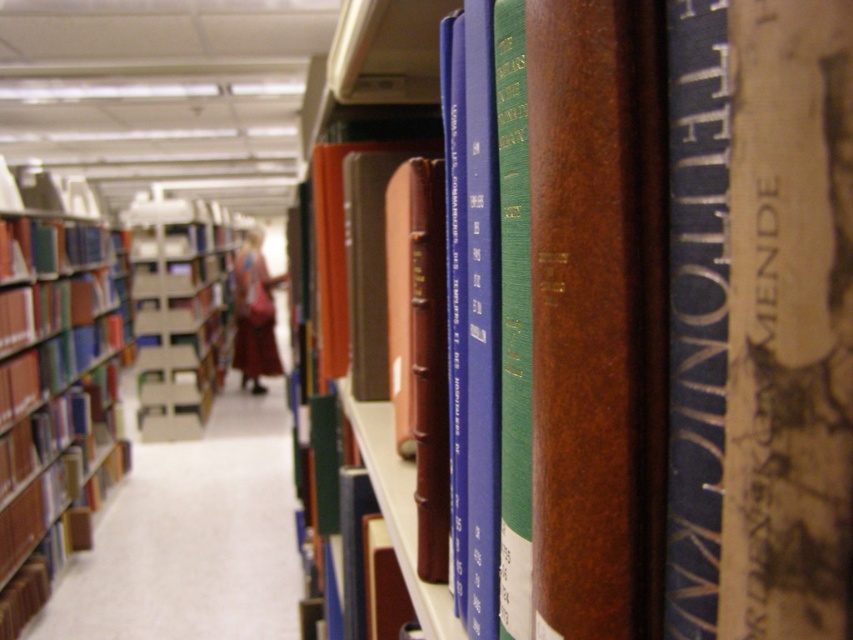
You are a librarian who needs to place a large dictionary that requires a shelf with more space. Which bookcase between the brown leather bookcase at left and the matte cardboard bookcase at center would be more suitable?

The brown leather bookcase at left has a larger size compared to the matte cardboard bookcase at center, so it would be more suitable for placing the large dictionary that requires more space.

You are a librarian who needs to place a new book on the shelf. You have the brown leather book at center and the brown leather bookcase at left. Which one should you place the new book on, and why?

You should place the new book on the brown leather bookcase at left because the brown leather book at center is already positioned over it, indicating that the bookcase is the proper shelf for storing books.

You are a librarian who wants to retrieve the brown leather book at center from its position in front of the brown leather bookcase at left. Can you easily access it without moving the bookcase?

Yes, the brown leather book at center is in front of the brown leather bookcase at left, so it can be accessed directly without moving the bookcase.